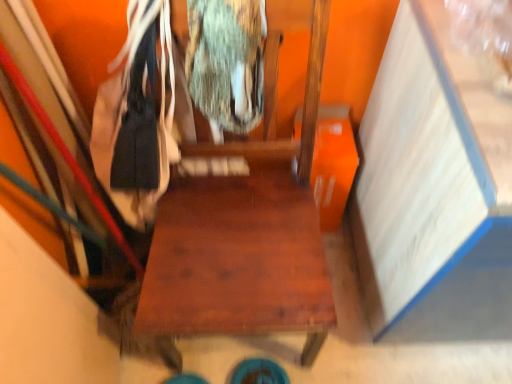
Find the location of a particular element. Image resolution: width=512 pixels, height=384 pixels. wooden chair at center is located at coordinates (248, 224).

The height and width of the screenshot is (384, 512). What do you see at coordinates (248, 224) in the screenshot?
I see `wooden chair at center` at bounding box center [248, 224].

Identify the location of wooden chair at center. Image resolution: width=512 pixels, height=384 pixels. (248, 224).